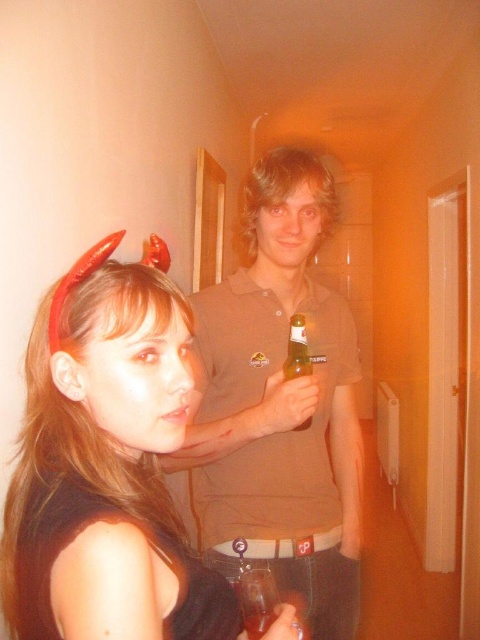
Question: Which object is the closest to the brown cotton shirt at center?

Choices:
 (A) clear glass beer bottle at center
 (B) red plastic horns at upper left

Answer: (A)

Question: Which object is closer to the camera taking this photo?

Choices:
 (A) matte black dress at center
 (B) red plastic horns at upper left
 (C) translucent glass at center
 (D) brown cotton shirt at center

Answer: (A)

Question: Does red plastic horns at upper left appear on the right side of translucent glass at center?

Choices:
 (A) yes
 (B) no

Answer: (B)

Question: Is matte black dress at center below red plastic horns at upper left?

Choices:
 (A) yes
 (B) no

Answer: (A)

Question: Which of the following is the closest to the observer?

Choices:
 (A) matte black dress at center
 (B) translucent glass at center
 (C) clear glass beer bottle at center
 (D) brown cotton shirt at center

Answer: (A)

Question: Can you confirm if matte black dress at center is bigger than clear glass beer bottle at center?

Choices:
 (A) yes
 (B) no

Answer: (A)